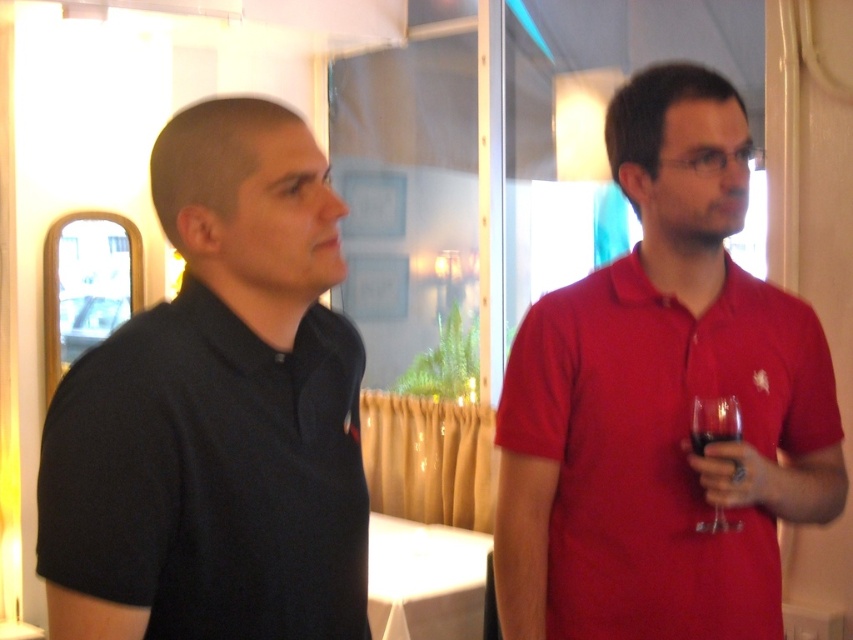
Looking at this image, which of these two, black matte shirt at left or transparent glass at right, stands shorter?

With less height is transparent glass at right.

Can you confirm if black matte shirt at left is bigger than transparent glass at right?

Correct, black matte shirt at left is larger in size than transparent glass at right.

Find the location of a particular element. black matte shirt at left is located at coordinates (218, 412).

You are a GUI agent. You are given a task and a screenshot of the screen. Output one action in this format:
    pyautogui.click(x=<x>, y=<y>)
    Task: Click on the black matte shirt at left
    
    Given the screenshot: What is the action you would take?
    pyautogui.click(x=218, y=412)

Is black matte shirt at left to the right of matte red polo shirt at right from the viewer's perspective?

No, black matte shirt at left is not to the right of matte red polo shirt at right.

Image resolution: width=853 pixels, height=640 pixels. In order to click on black matte shirt at left in this screenshot , I will do `click(218, 412)`.

Identify the location of black matte shirt at left. The width and height of the screenshot is (853, 640). (218, 412).

Is matte red polo shirt at right in front of transparent glass at right?

Yes, matte red polo shirt at right is closer to the viewer.

Describe the element at coordinates (662, 403) in the screenshot. I see `matte red polo shirt at right` at that location.

Who is more forward, [583,588] or [735,410]?

Point [735,410] is more forward.

Locate an element on the screen. The image size is (853, 640). matte red polo shirt at right is located at coordinates (662, 403).